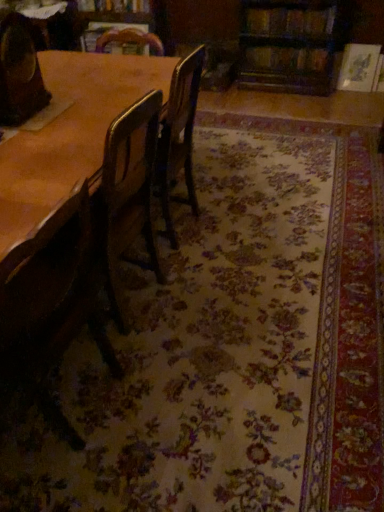
In order to click on vacant space behind wooden chair at left, which is the first chair in top-to-bottom order in this screenshot , I will do `click(63, 92)`.